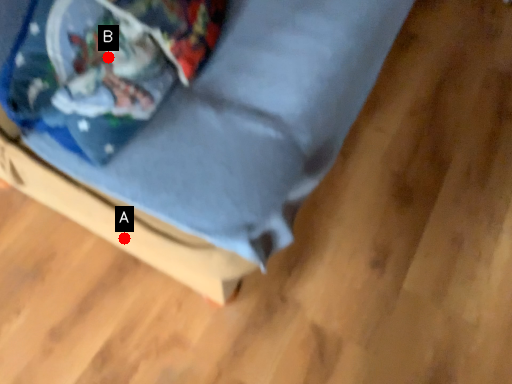
Question: Two points are circled on the image, labeled by A and B beside each circle. Which of the following is the farthest from the observer?

Choices:
 (A) A is further
 (B) B is further

Answer: (A)